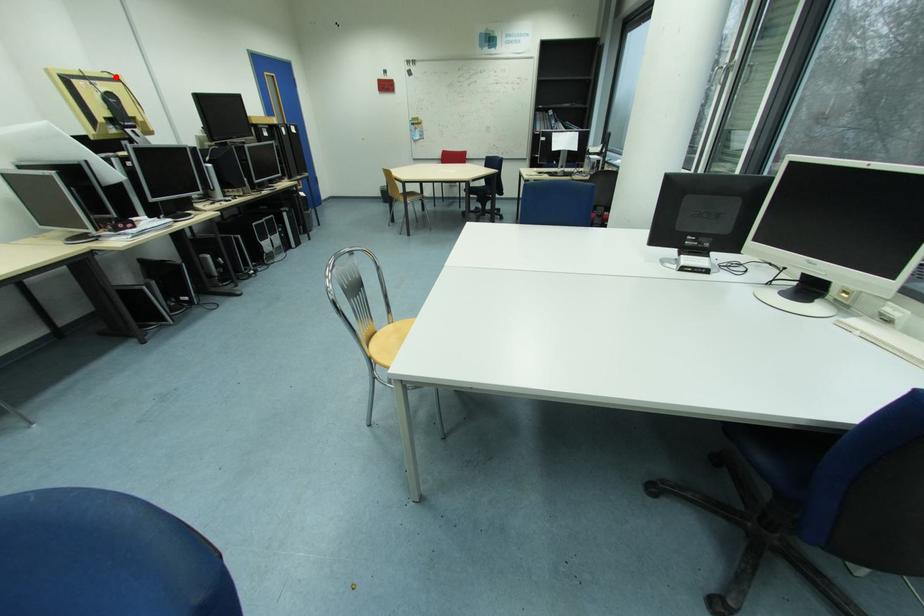
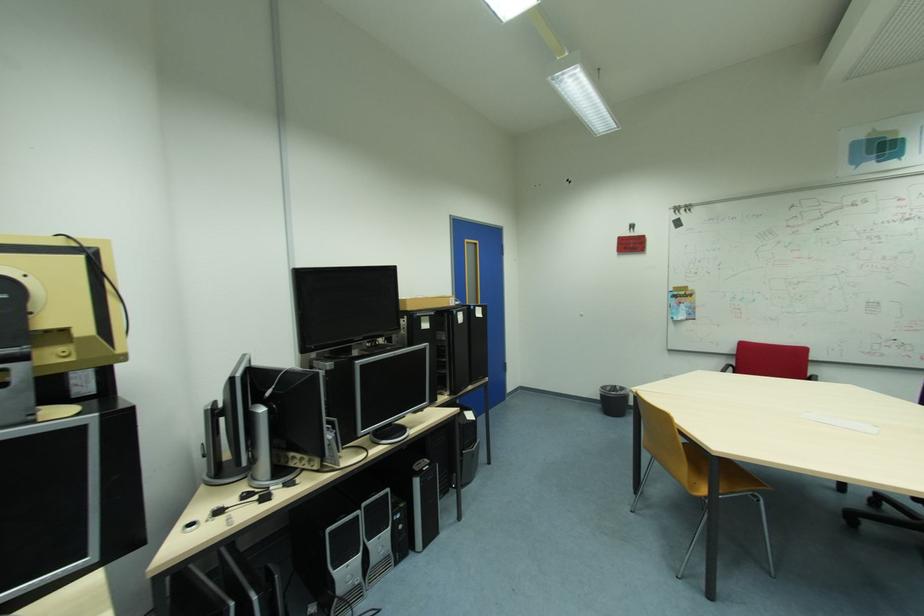
Question: I am providing you with two images of the same scene from different viewpoints. A red point is marked on the first image. Can you still see the location of the red point in image 2?

Choices:
 (A) Yes
 (B) No

Answer: (A)